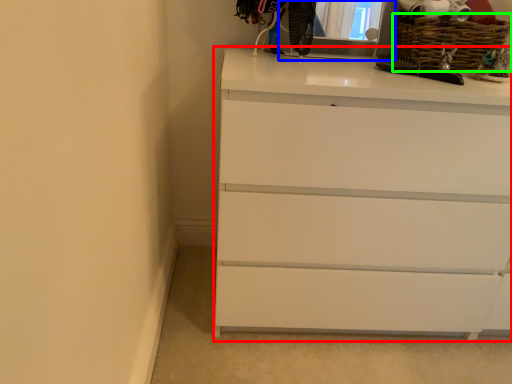
Question: Which is farther away from chest of drawers (highlighted by a red box)? medicine cabinet (highlighted by a blue box) or basket (highlighted by a green box)?

Choices:
 (A) medicine cabinet
 (B) basket

Answer: (A)